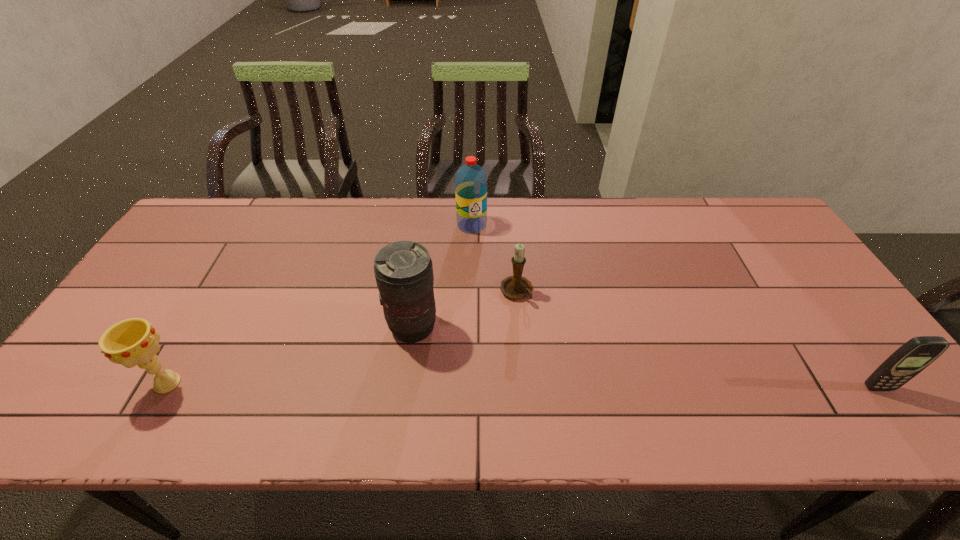
Identify the location of empty location between the fourth nearest object and the rightmost object. (697, 340).

Identify the location of free space between the second object from right to left and the rightmost object. Image resolution: width=960 pixels, height=540 pixels. [x=697, y=340].

This screenshot has width=960, height=540. Find the location of `free space that is in between the telephoto lens and the leftmost object`. free space that is in between the telephoto lens and the leftmost object is located at coordinates (290, 355).

At what (x,y) coordinates should I click in order to perform the action: click on empty space that is in between the candle holder and the cellular telephone. Please return your answer as a coordinate pair (x, y). Looking at the image, I should click on (697, 340).

Where is `free space between the water bottle and the second object from left to right`? This screenshot has width=960, height=540. free space between the water bottle and the second object from left to right is located at coordinates (443, 276).

At what (x,y) coordinates should I click in order to perform the action: click on vacant area between the fourth object from left to right and the rightmost object. Please return your answer as a coordinate pair (x, y). The image size is (960, 540). Looking at the image, I should click on (697, 340).

I want to click on free space between the chalice and the cellular telephone, so click(523, 386).

Locate an element on the screen. This screenshot has height=540, width=960. free space between the candle holder and the third object from right to left is located at coordinates (494, 259).

At what (x,y) coordinates should I click in order to perform the action: click on the closest object to the rightmost object. Please return your answer as a coordinate pair (x, y). Looking at the image, I should click on (515, 287).

Find the location of `the third closest object to the chalice`. the third closest object to the chalice is located at coordinates (470, 180).